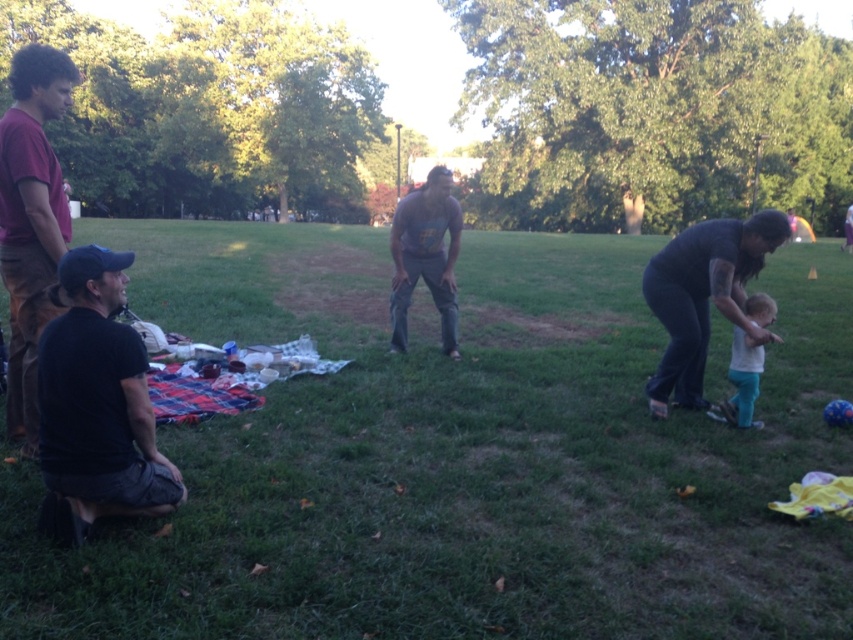
You are standing in the park and see the green grass at center and the white cotton shirt at right. Which object is higher from the ground?

The green grass at center is higher from the ground than the white cotton shirt at right.

You are standing in the park and see the green grass at center and the white cotton shirt at right. Which object is closer to you?

The green grass at center is closer to you because it is in front of the white cotton shirt at right.

You are organizing a clothing donation drive and need to determine which shirt takes up more space. Based on the image, which of the two shirts, the maroon cotton shirt at left or the white cotton shirt at right, is wider?

The maroon cotton shirt at left is wider than the white cotton shirt at right.